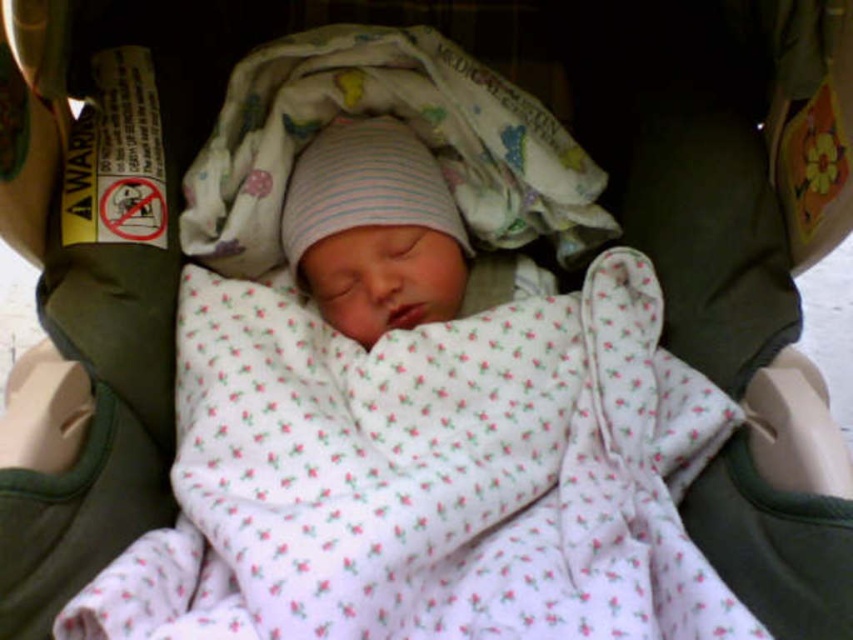
You are a nurse checking on a newborn in a car seat. You notice a point at coordinates (427, 476). What is located at that point?

At point (427, 476) lies the white floral fabric at center.

You are a nurse in a hospital nursery. You need to determine which item is wider when placing them side by side on a shelf. Which one is wider between the white floral fabric at center and the white cotton blanket at center?

The white floral fabric at center is wider than the white cotton blanket at center according to the description.

You are a photographer taking a picture of the newborn baby in the car seat. You notice two points marked in the image. Which point, point 1 at coordinates (433, 408) or point 2 at coordinates (521, 140), is closer to the camera?

Point 1 at coordinates (433, 408) is closer to the camera than point 2 at coordinates (521, 140).